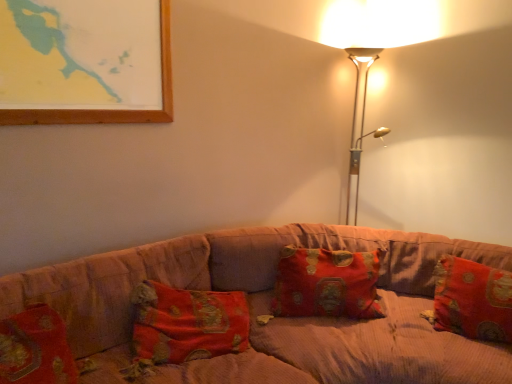
Question: Is point (207, 367) positioned closer to the camera than point (430, 21)?

Choices:
 (A) farther
 (B) closer

Answer: (B)

Question: Is corduroy fabric couch at center situated inside metallic gold floor lamp at upper right or outside?

Choices:
 (A) inside
 (B) outside

Answer: (B)

Question: Estimate the real-world distances between objects in this image. Which object is farther from the red brocade pillow at center, which appears as the 1th pillow when viewed from the left?

Choices:
 (A) red brocade pillow at right, which ranks as the 1th pillow in right-to-left order
 (B) corduroy fabric couch at center
 (C) metallic gold floor lamp at upper right

Answer: (C)

Question: Which object is the closest to the corduroy fabric couch at center?

Choices:
 (A) red brocade pillow at right, which ranks as the 1th pillow in right-to-left order
 (B) red brocade pillow at center, which appears as the 1th pillow when viewed from the left
 (C) metallic gold floor lamp at upper right

Answer: (B)